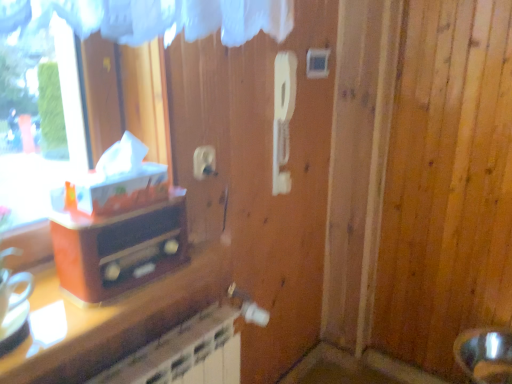
What do you see at coordinates (317, 63) in the screenshot? The height and width of the screenshot is (384, 512). I see `white plastic light switch at upper center` at bounding box center [317, 63].

The height and width of the screenshot is (384, 512). In order to click on white plastic electric outlet at upper center in this screenshot , I will do `click(204, 162)`.

Locate an element on the screen. The width and height of the screenshot is (512, 384). white plastic light switch at upper center is located at coordinates (317, 63).

Is white plastic electric outlet at upper center shorter than matte orange radio at left?

Yes.

Which is more to the left, white plastic electric outlet at upper center or matte orange radio at left?

From the viewer's perspective, matte orange radio at left appears more on the left side.

Can you tell me how much white plastic electric outlet at upper center and matte orange radio at left differ in facing direction?

The facing directions of white plastic electric outlet at upper center and matte orange radio at left are 1.67 degrees apart.

Would you say white plastic electric outlet at upper center is a long distance from matte orange radio at left?

No, white plastic electric outlet at upper center is in close proximity to matte orange radio at left.

Is matte orange radio at left not inside white plastic electric outlet at upper center?

Absolutely, matte orange radio at left is external to white plastic electric outlet at upper center.

From a real-world perspective, which object stands above the other?

In real-world perspective, white plastic electric outlet at upper center is above.

Which point is more forward, (175, 254) or (215, 170)?

The point (175, 254) is more forward.

I want to click on light switch above the white plastic electric outlet at upper center (from a real-world perspective), so click(317, 63).

Considering the positions of point (325, 53) and point (213, 159), is point (325, 53) closer or farther from the camera than point (213, 159)?

Point (325, 53) is positioned farther from the camera compared to point (213, 159).

Is the depth of white plastic light switch at upper center greater than that of white plastic electric outlet at upper center?

Yes, white plastic light switch at upper center is further from the camera.

From the image's perspective, is white plastic light switch at upper center beneath white plastic electric outlet at upper center?

No, from the image's perspective, white plastic light switch at upper center is not beneath white plastic electric outlet at upper center.

Looking at this image, is white plastic electric outlet at upper center at the right side of white plastic light switch at upper center?

No, white plastic electric outlet at upper center is not to the right of white plastic light switch at upper center.

Which of these two, white plastic electric outlet at upper center or white plastic light switch at upper center, is thinner?

white plastic electric outlet at upper center is thinner.

In the scene shown: Is white plastic electric outlet at upper center turned away from white plastic light switch at upper center?

No, white plastic electric outlet at upper center is not facing away from white plastic light switch at upper center.

From the image's perspective, which is above, matte orange radio at left or white plastic light switch at upper center?

white plastic light switch at upper center.

Is matte orange radio at left behind white plastic light switch at upper center?

No, matte orange radio at left is in front of white plastic light switch at upper center.

Does matte orange radio at left have a smaller size compared to white plastic light switch at upper center?

No, matte orange radio at left is not smaller than white plastic light switch at upper center.

Does matte orange radio at left appear on the right side of white plastic light switch at upper center?

In fact, matte orange radio at left is to the left of white plastic light switch at upper center.

Considering the positions of objects white plastic light switch at upper center and matte orange radio at left in the image provided, who is behind, white plastic light switch at upper center or matte orange radio at left?

white plastic light switch at upper center is further from the camera.

Considering the points (327, 54) and (140, 272), which point is behind, point (327, 54) or point (140, 272)?

Positioned behind is point (327, 54).

Based on the photo, is white plastic light switch at upper center not close to matte orange radio at left?

white plastic light switch at upper center is near matte orange radio at left, not far away.

Locate an element on the screen. furniture lying in front of the white plastic light switch at upper center is located at coordinates (119, 248).

Locate an element on the screen. furniture located on the left of white plastic electric outlet at upper center is located at coordinates (119, 248).

Identify the location of electric outlet behind the matte orange radio at left. This screenshot has width=512, height=384. (x=204, y=162).

Based on their spatial positions, is matte orange radio at left or white plastic electric outlet at upper center closer to white plastic light switch at upper center?

white plastic electric outlet at upper center lies closer to white plastic light switch at upper center than the other object.

Which object lies nearer to the anchor point white plastic electric outlet at upper center, white plastic light switch at upper center or matte orange radio at left?

matte orange radio at left is closer to white plastic electric outlet at upper center.

When comparing their distances from matte orange radio at left, does white plastic light switch at upper center or white plastic electric outlet at upper center seem further?

white plastic light switch at upper center is further to matte orange radio at left.

Which object lies further to the anchor point matte orange radio at left, white plastic electric outlet at upper center or white plastic light switch at upper center?

white plastic light switch at upper center.

From the image, which object appears to be farther from white plastic electric outlet at upper center, matte orange radio at left or white plastic light switch at upper center?

white plastic light switch at upper center.

From the image, which object appears to be nearer to white plastic light switch at upper center, white plastic electric outlet at upper center or matte orange radio at left?

white plastic electric outlet at upper center lies closer to white plastic light switch at upper center than the other object.

What are the coordinates of `electric outlet positioned between matte orange radio at left and white plastic light switch at upper center from near to far` in the screenshot? It's located at (204, 162).